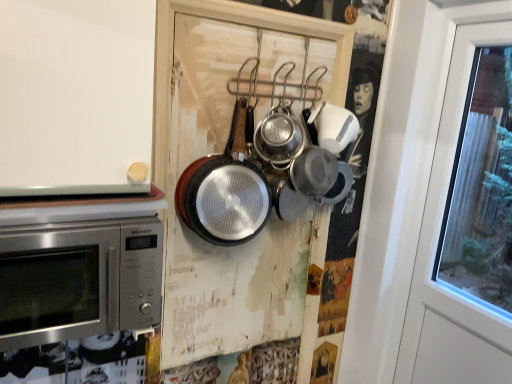
Question: Considering the relative positions of silver textured frying pan at center, the 1th frying pan when ordered from right to left, and black textured frying pan at center, acting as the first frying pan starting from the left, in the image provided, is silver textured frying pan at center, the 1th frying pan when ordered from right to left, to the right of black textured frying pan at center, acting as the first frying pan starting from the left, from the viewer's perspective?

Choices:
 (A) yes
 (B) no

Answer: (A)

Question: From a real-world perspective, is silver textured frying pan at center, placed as the 2th frying pan when sorted from left to right, on black textured frying pan at center, which ranks as the second frying pan in right-to-left order?

Choices:
 (A) no
 (B) yes

Answer: (B)

Question: Is silver textured frying pan at center, placed as the 2th frying pan when sorted from left to right, positioned in front of black textured frying pan at center, which ranks as the second frying pan in right-to-left order?

Choices:
 (A) yes
 (B) no

Answer: (B)

Question: Can you confirm if silver textured frying pan at center, placed as the 2th frying pan when sorted from left to right, is smaller than black textured frying pan at center, which ranks as the second frying pan in right-to-left order?

Choices:
 (A) no
 (B) yes

Answer: (B)

Question: Is silver textured frying pan at center, the 1th frying pan when ordered from right to left, not within black textured frying pan at center, which ranks as the second frying pan in right-to-left order?

Choices:
 (A) no
 (B) yes

Answer: (B)

Question: From the image's perspective, is silver textured frying pan at center, the 1th frying pan when ordered from right to left, beneath black textured frying pan at center, acting as the first frying pan starting from the left?

Choices:
 (A) yes
 (B) no

Answer: (B)

Question: Is the depth of stainless steel microwave at left less than that of silver textured frying pan at center, placed as the 2th frying pan when sorted from left to right?

Choices:
 (A) no
 (B) yes

Answer: (B)

Question: Could you tell me if stainless steel microwave at left is facing silver textured frying pan at center, placed as the 2th frying pan when sorted from left to right?

Choices:
 (A) yes
 (B) no

Answer: (B)

Question: From a real-world perspective, is stainless steel microwave at left on silver textured frying pan at center, placed as the 2th frying pan when sorted from left to right?

Choices:
 (A) no
 (B) yes

Answer: (A)

Question: Is stainless steel microwave at left located outside silver textured frying pan at center, placed as the 2th frying pan when sorted from left to right?

Choices:
 (A) yes
 (B) no

Answer: (A)

Question: Can you confirm if stainless steel microwave at left is thinner than silver textured frying pan at center, the 1th frying pan when ordered from right to left?

Choices:
 (A) yes
 (B) no

Answer: (B)

Question: Is stainless steel microwave at left turned away from silver textured frying pan at center, placed as the 2th frying pan when sorted from left to right?

Choices:
 (A) no
 (B) yes

Answer: (A)

Question: Does black textured frying pan at center, acting as the first frying pan starting from the left, have a larger size compared to silver textured frying pan at center, placed as the 2th frying pan when sorted from left to right?

Choices:
 (A) yes
 (B) no

Answer: (A)